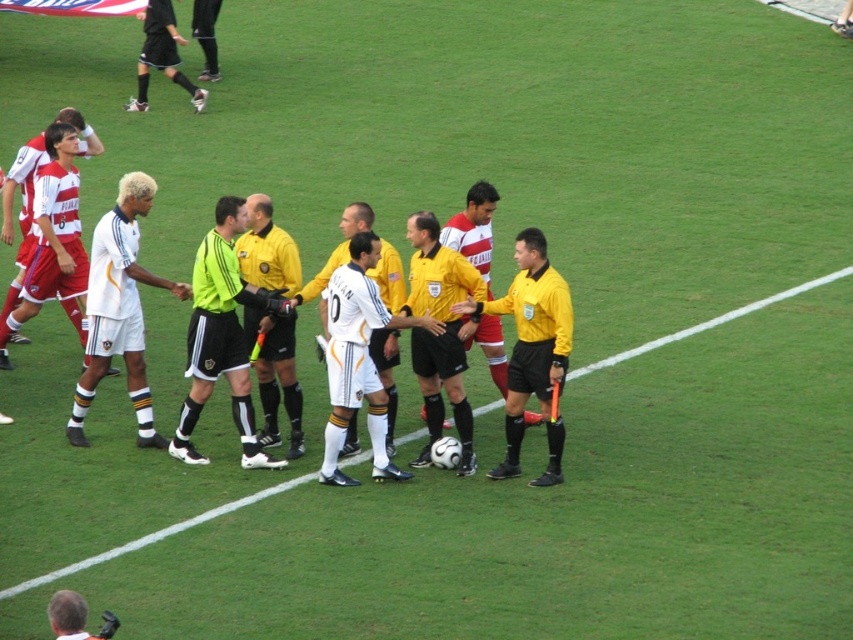
Which is below, yellow jersey at center or matte white jersey at left?

yellow jersey at center

Does yellow jersey at center have a larger size compared to matte white jersey at left?

Incorrect, yellow jersey at center is not larger than matte white jersey at left.

Identify the location of yellow jersey at center. (440, 333).

Measure the distance between point [242,381] and camera.

A distance of 34.73 feet exists between point [242,381] and camera.

Is neon yellow jersey at center to the left of yellow matte referee at center from the viewer's perspective?

Indeed, neon yellow jersey at center is positioned on the left side of yellow matte referee at center.

Between point (241, 298) and point (529, 321), which one is positioned behind?

The point (241, 298) is behind.

Identify the location of neon yellow jersey at center. Image resolution: width=853 pixels, height=640 pixels. (222, 337).

Describe the element at coordinates (222, 337) in the screenshot. The height and width of the screenshot is (640, 853). I see `neon yellow jersey at center` at that location.

Which of these two, neon yellow jersey at center or matte white jersey at left, stands taller?

Standing taller between the two is neon yellow jersey at center.

Who is more distant from viewer, (244, 445) or (10, 234)?

Positioned behind is point (10, 234).

You are a GUI agent. You are given a task and a screenshot of the screen. Output one action in this format:
    pyautogui.click(x=<x>, y=<y>)
    Task: Click on the neon yellow jersey at center
    
    Given the screenshot: What is the action you would take?
    pyautogui.click(x=222, y=337)